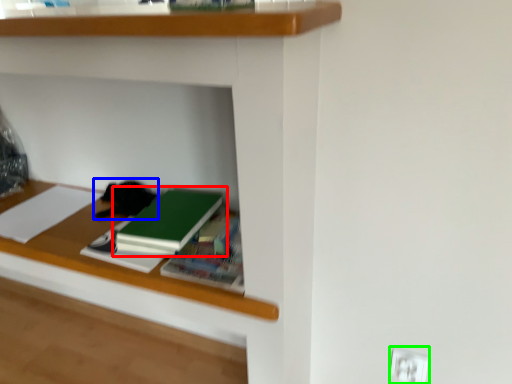
Question: Which is nearer to the book (highlighted by a red box)? cat (highlighted by a blue box) or electric outlet (highlighted by a green box).

Choices:
 (A) cat
 (B) electric outlet

Answer: (A)